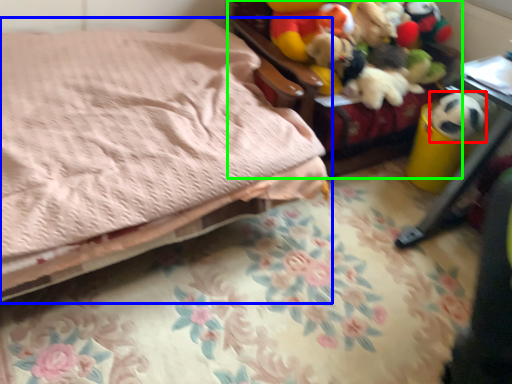
Question: Which is farther away from animal (highlighted by a red box)? bed (highlighted by a blue box) or furniture (highlighted by a green box)?

Choices:
 (A) bed
 (B) furniture

Answer: (A)